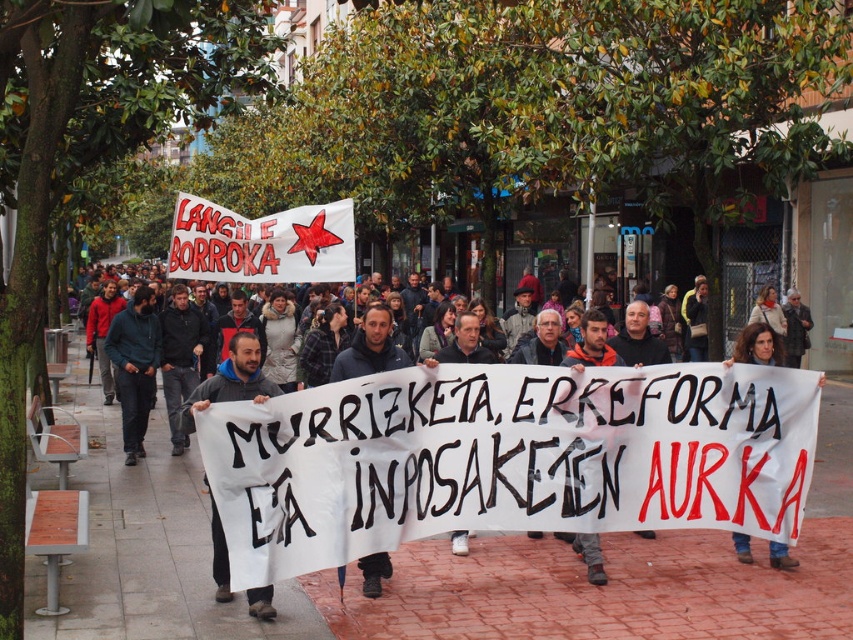
You are a photographer trying to capture the protest scene. You notice a person wearing a dark gray hoodie at center and another wearing jeans at center. From your position, which clothing item is positioned to the left?

The dark gray hoodie at center is to the left of the jeans at center.

You are a photographer standing at the edge of the protest. You want to capture a clear photo of the dark gray hoodie at center. If your camera can focus on objects up to 6 meters away, will you be able to take a clear photo?

The dark gray hoodie at center is 5.98 meters away from the viewer. Since the camera can focus up to 6 meters, it is within range, so yes, you can take a clear photo.

You are a photographer trying to capture the protest scene. You notice the dark gray hoodie at center. Based on its position, can you estimate whether it is closer to the front or the back of the group?

The dark gray hoodie at center is located at point (230, 380), which places it closer to the front of the group since lower y coordinates indicate positions closer to the viewer in the image coordinate system.